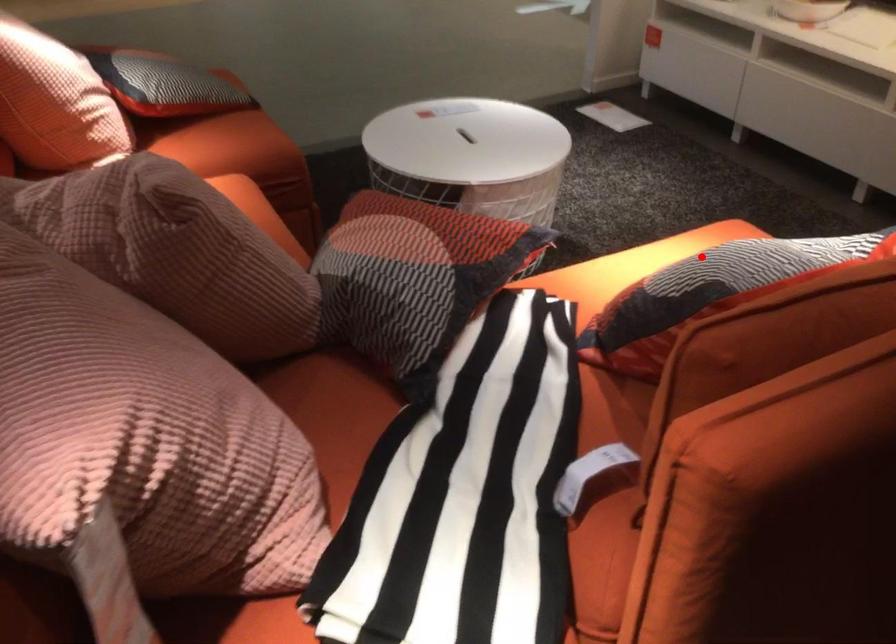
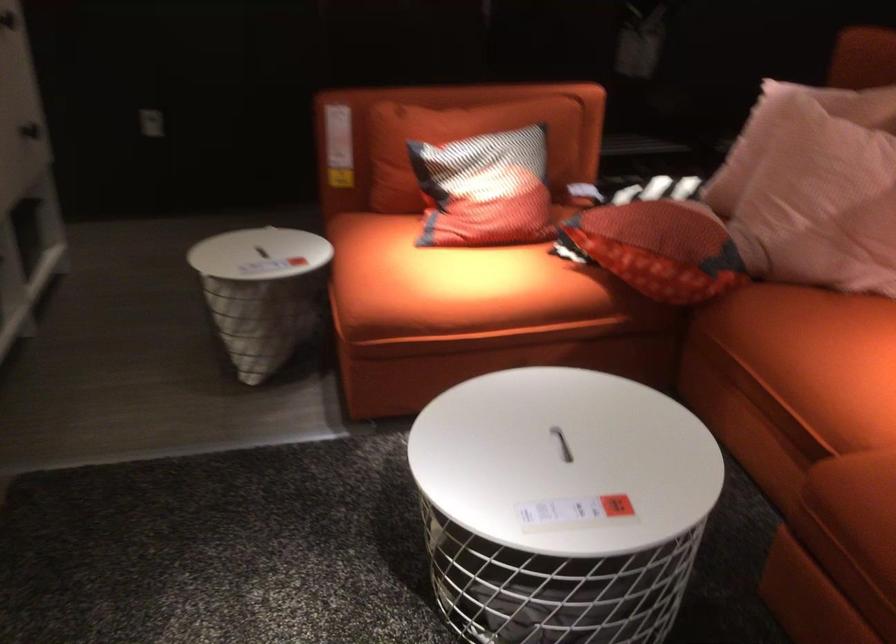
The point at the highlighted location is marked in the first image. Where is the corresponding point in the second image?

(485, 190)